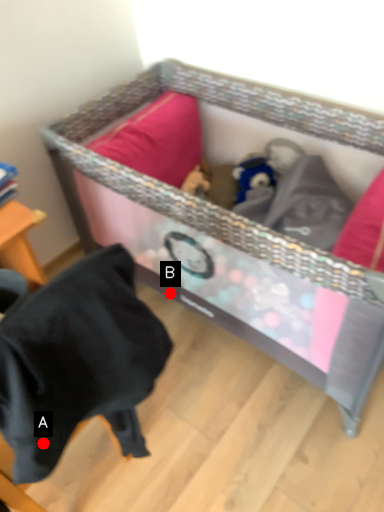
Question: Two points are circled on the image, labeled by A and B beside each circle. Which point is closer to the camera taking this photo?

Choices:
 (A) A is closer
 (B) B is closer

Answer: (A)